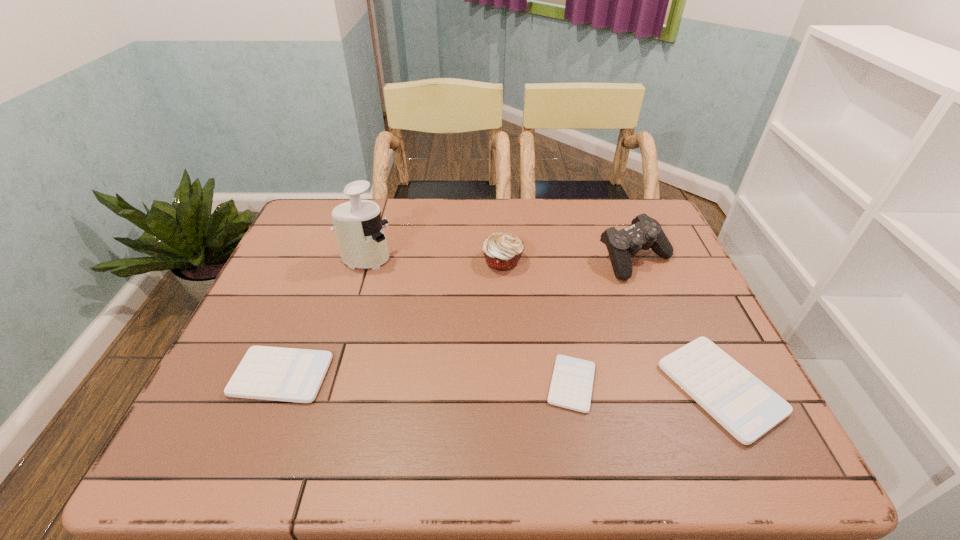
Identify the location of vacant region between the juicer and the fifth tallest object. (324, 318).

Find the location of a particular element. This screenshot has width=960, height=540. empty location between the rightmost calculator and the second calculator from left to right is located at coordinates (646, 386).

At what (x,y) coordinates should I click in order to perform the action: click on empty location between the leftmost calculator and the muffin. Please return your answer as a coordinate pair (x, y). The width and height of the screenshot is (960, 540). Looking at the image, I should click on (392, 318).

The height and width of the screenshot is (540, 960). Find the location of `empty space between the tallest object and the third object from left to right`. empty space between the tallest object and the third object from left to right is located at coordinates (434, 260).

Locate an element on the screen. The image size is (960, 540). empty location between the rightmost calculator and the muffin is located at coordinates (612, 325).

Locate an element on the screen. The width and height of the screenshot is (960, 540). object that is the third closest to the control is located at coordinates (572, 381).

Where is `object that stands as the third closest to the tallest object`? Image resolution: width=960 pixels, height=540 pixels. object that stands as the third closest to the tallest object is located at coordinates (572, 381).

In order to click on the third closest calculator to the control in this screenshot , I will do `click(268, 373)`.

Identify which calculator is the closest to the rightmost calculator. Please provide its 2D coordinates. Your answer should be formatted as a tuple, i.e. [(x, y)], where the tuple contains the x and y coordinates of a point satisfying the conditions above.

[(572, 381)]

What are the coordinates of `vacant space that satisfies the following two spatial constraints: 1. on the front side of the control; 2. on the left side of the rightmost calculator` in the screenshot? It's located at (687, 388).